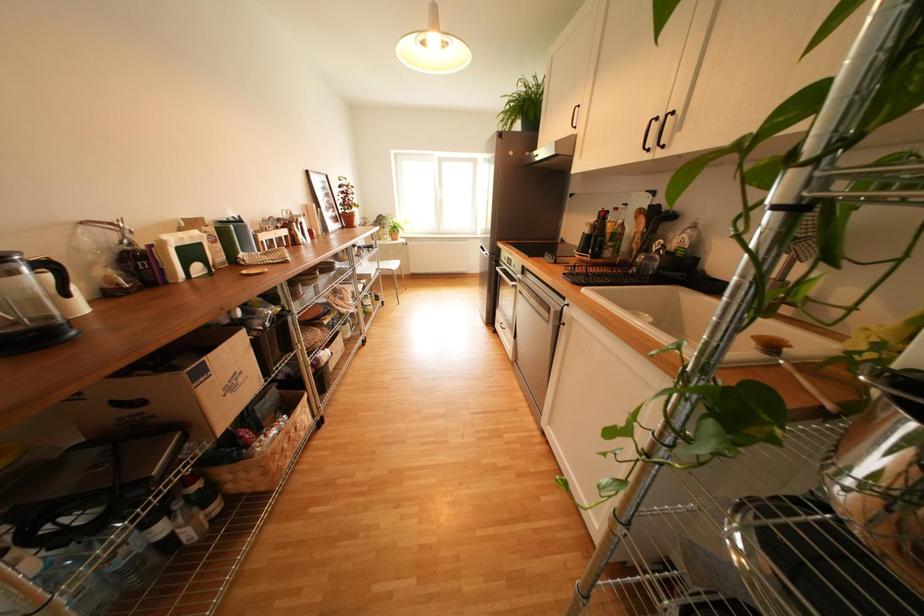
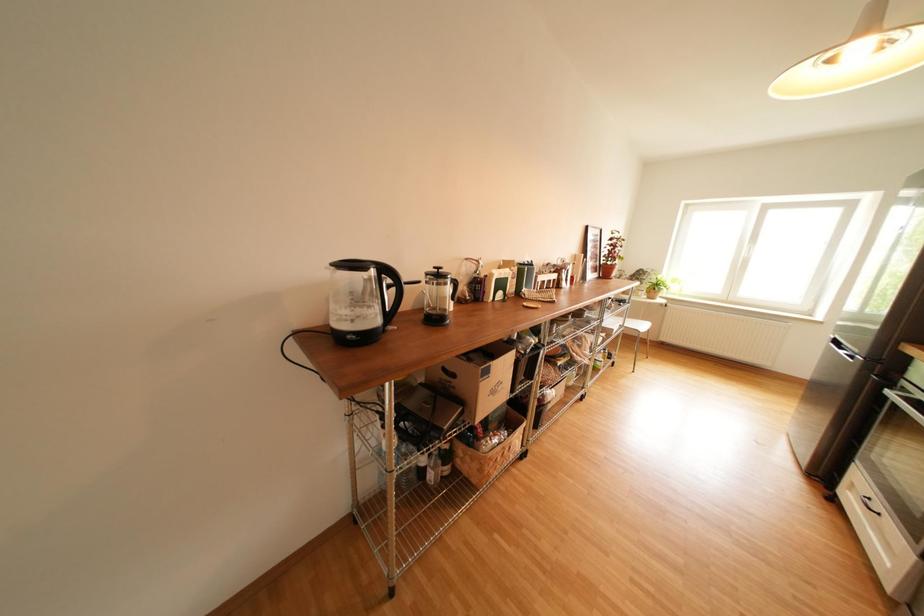
Question: How did the camera likely rotate?

Choices:
 (A) Left
 (B) Right
 (C) Up
 (D) Down

Answer: (A)